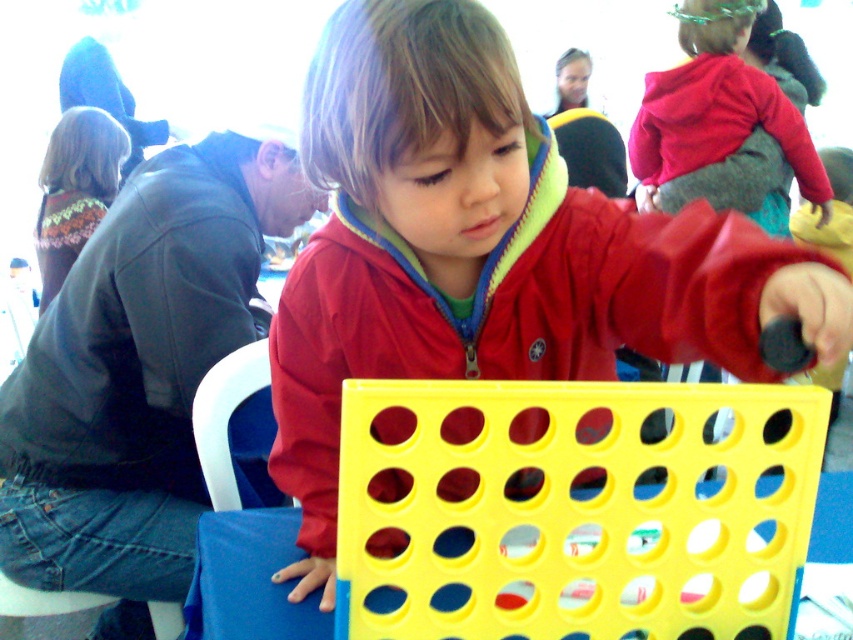
Does matte plastic child at center come behind yellow plastic table at center?

That is False.

Who is positioned more to the right, matte plastic child at center or yellow plastic table at center?

yellow plastic table at center is more to the right.

I want to click on matte plastic child at center, so click(x=488, y=252).

The width and height of the screenshot is (853, 640). Find the location of `matte plastic child at center`. matte plastic child at center is located at coordinates (488, 252).